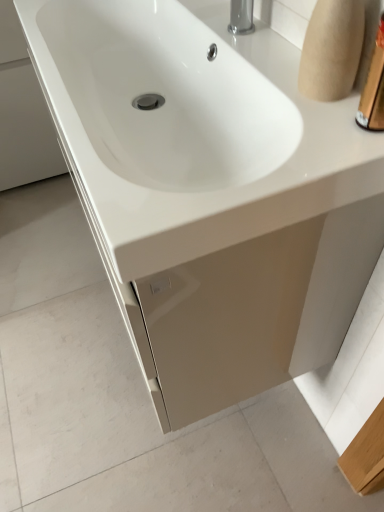
Question: Considering the relative positions of gold metallic container at upper right and white glossy sink at center in the image provided, is gold metallic container at upper right behind white glossy sink at center?

Choices:
 (A) yes
 (B) no

Answer: (B)

Question: Would you say gold metallic container at upper right contains white glossy sink at center?

Choices:
 (A) yes
 (B) no

Answer: (B)

Question: From a real-world perspective, is gold metallic container at upper right located higher than white glossy sink at center?

Choices:
 (A) no
 (B) yes

Answer: (B)

Question: Considering the relative positions of gold metallic container at upper right and white glossy sink at center in the image provided, is gold metallic container at upper right to the right of white glossy sink at center from the viewer's perspective?

Choices:
 (A) no
 (B) yes

Answer: (B)

Question: From a real-world perspective, is gold metallic container at upper right beneath white glossy sink at center?

Choices:
 (A) yes
 (B) no

Answer: (B)

Question: Could you tell me if gold metallic container at upper right is facing white glossy sink at center?

Choices:
 (A) no
 (B) yes

Answer: (A)

Question: Is white glossy sink at center to the left of gold metallic container at upper right from the viewer's perspective?

Choices:
 (A) no
 (B) yes

Answer: (B)

Question: Can you confirm if white glossy sink at center is thinner than gold metallic container at upper right?

Choices:
 (A) yes
 (B) no

Answer: (B)

Question: Considering the relative positions of white glossy sink at center and gold metallic container at upper right in the image provided, is white glossy sink at center behind gold metallic container at upper right?

Choices:
 (A) no
 (B) yes

Answer: (B)

Question: Can you confirm if white glossy sink at center is smaller than gold metallic container at upper right?

Choices:
 (A) yes
 (B) no

Answer: (B)

Question: Is white glossy sink at center located outside gold metallic container at upper right?

Choices:
 (A) yes
 (B) no

Answer: (A)

Question: From the image's perspective, is white glossy sink at center on top of gold metallic container at upper right?

Choices:
 (A) yes
 (B) no

Answer: (A)

Question: Looking at the image, does white glossy sink at center seem bigger or smaller compared to gold metallic container at upper right?

Choices:
 (A) big
 (B) small

Answer: (A)